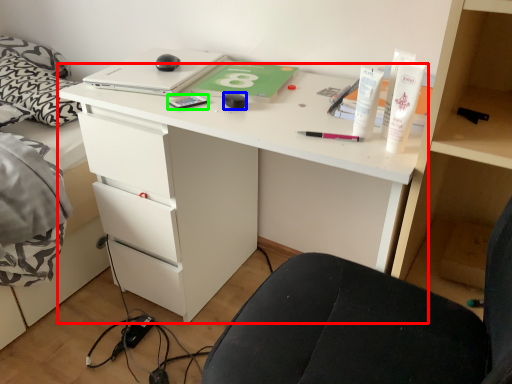
Question: Which is farther away from desk (highlighted by a red box)? stationery (highlighted by a blue box) or stationery (highlighted by a green box)?

Choices:
 (A) stationery
 (B) stationery

Answer: (A)